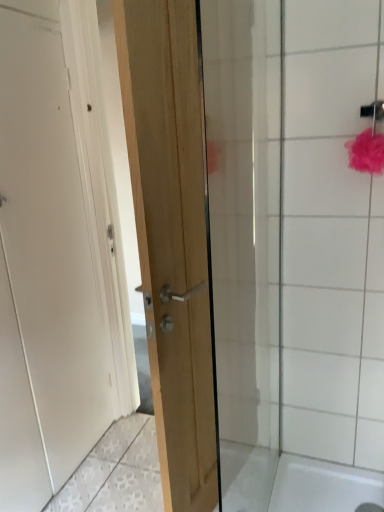
Question: In the image, is white matte door at left, the 1th door from the left, positioned in front of or behind white glossy shower door at upper right?

Choices:
 (A) behind
 (B) front

Answer: (B)

Question: From the image's perspective, relative to white glossy shower door at upper right, is white matte door at left, the second door viewed from the right, above or below?

Choices:
 (A) above
 (B) below

Answer: (A)

Question: Estimate the real-world distances between objects in this image. Which object is farther from the white matte door at left, the 1th door from the left?

Choices:
 (A) natural wood door at center, marked as the 1th door in a right-to-left arrangement
 (B) white glossy shower door at upper right

Answer: (B)

Question: Based on their relative distances, which object is nearer to the white glossy shower door at upper right?

Choices:
 (A) white matte door at left, the second door viewed from the right
 (B) natural wood door at center, which ranks as the second door in left-to-right order

Answer: (B)